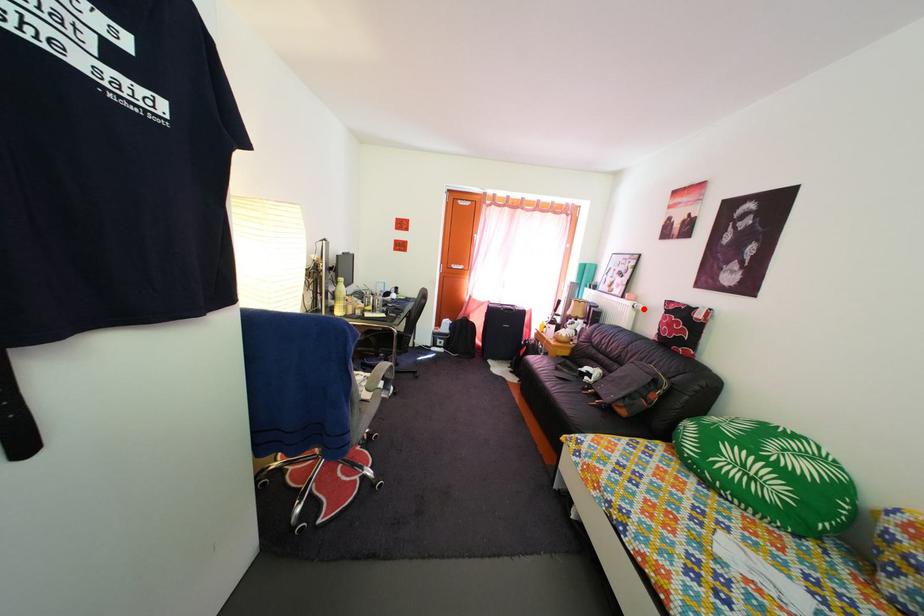
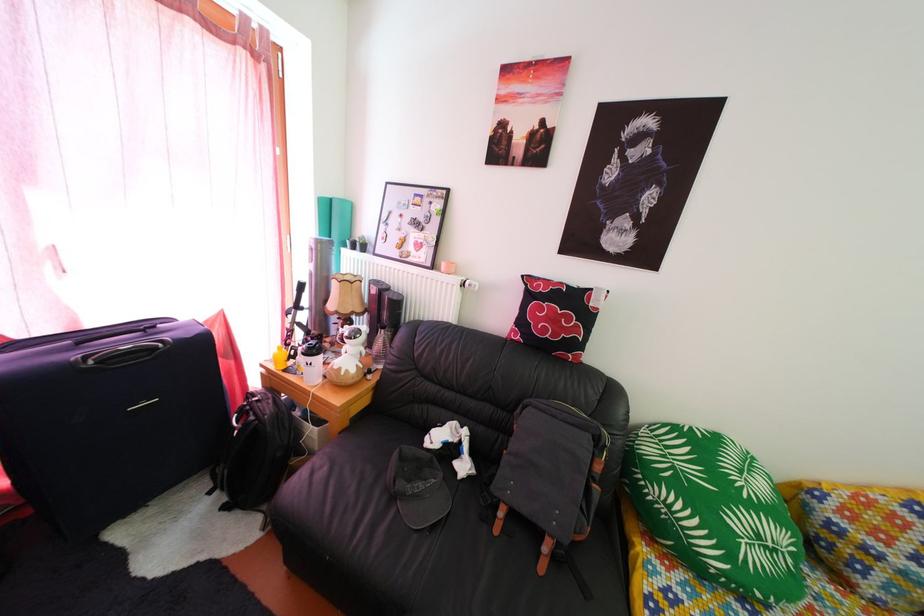
In the second image, find the point that corresponds to the highlighted location in the first image.

(464, 282)